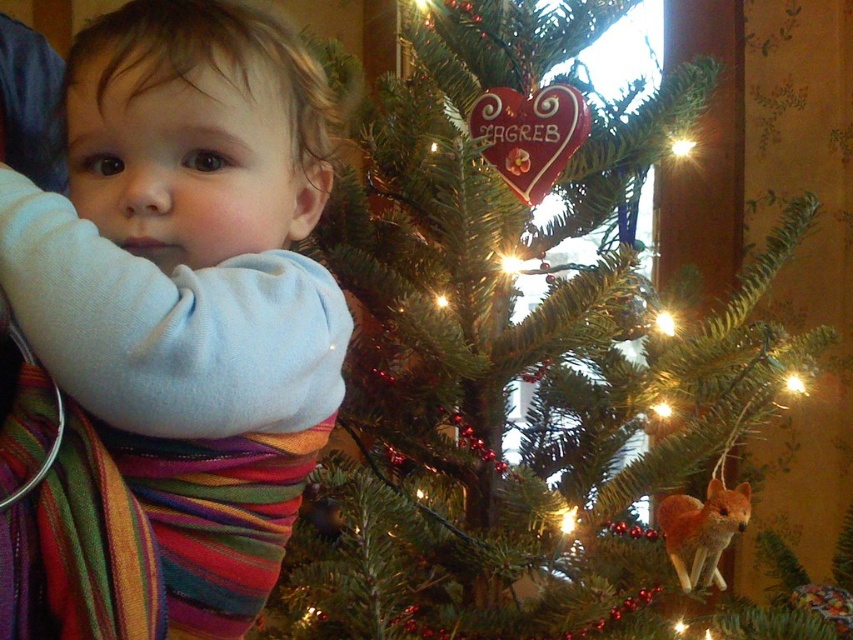
Question: Is green matte christmas tree at center bigger than white soft baby at center?

Choices:
 (A) yes
 (B) no

Answer: (A)

Question: Can you confirm if green matte christmas tree at center is smaller than white soft baby at center?

Choices:
 (A) no
 (B) yes

Answer: (A)

Question: Which of the following is the closest to the observer?

Choices:
 (A) (537, 317)
 (B) (155, 582)

Answer: (B)

Question: Which of the following is the farthest from the observer?

Choices:
 (A) green matte christmas tree at center
 (B) white soft baby at center

Answer: (A)

Question: Is green matte christmas tree at center to the left of white soft baby at center from the viewer's perspective?

Choices:
 (A) no
 (B) yes

Answer: (A)